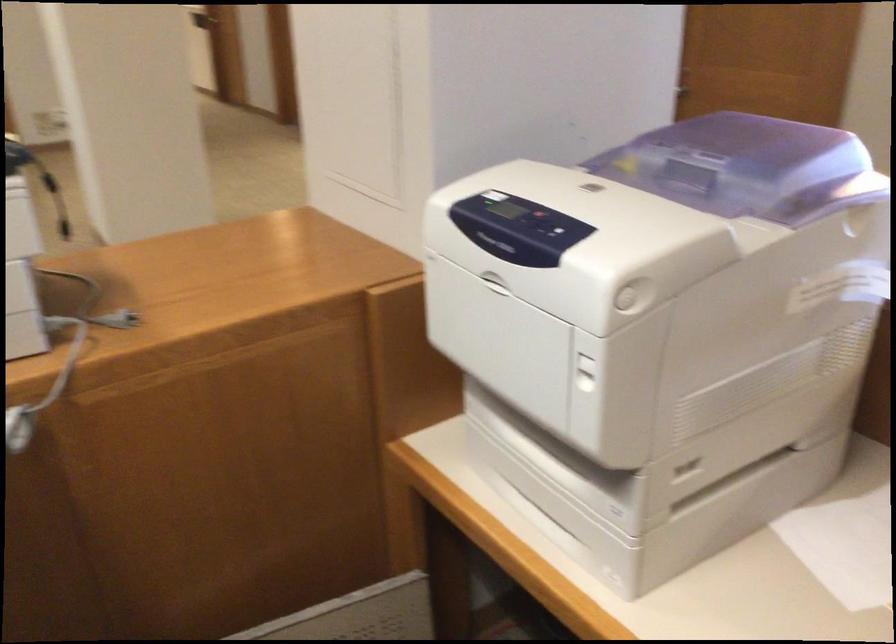
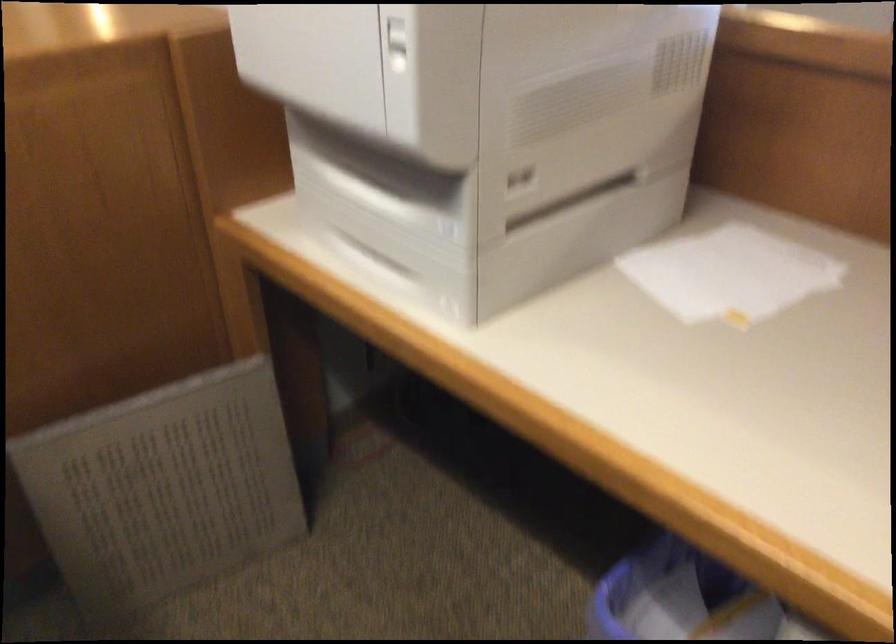
The images are taken continuously from a first-person perspective. In which direction are you moving?

The movement direction of the cameraman is right, forward.